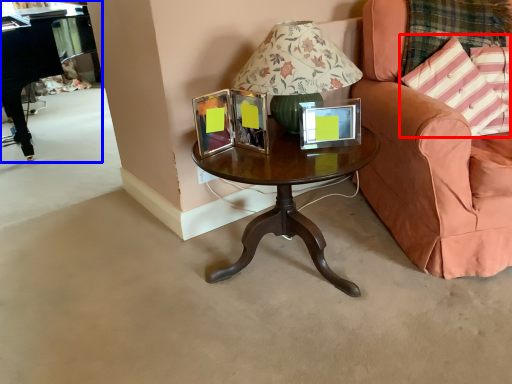
Question: Which object is further to the camera taking this photo, pillow (highlighted by a red box) or piano (highlighted by a blue box)?

Choices:
 (A) pillow
 (B) piano

Answer: (B)